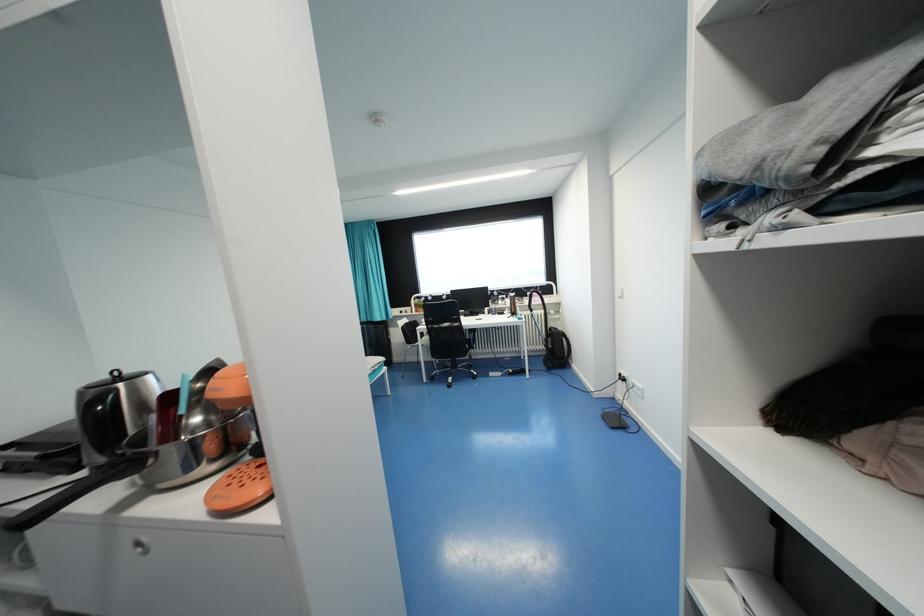
Which object does [555,349] point to?

It refers to a black backpack.